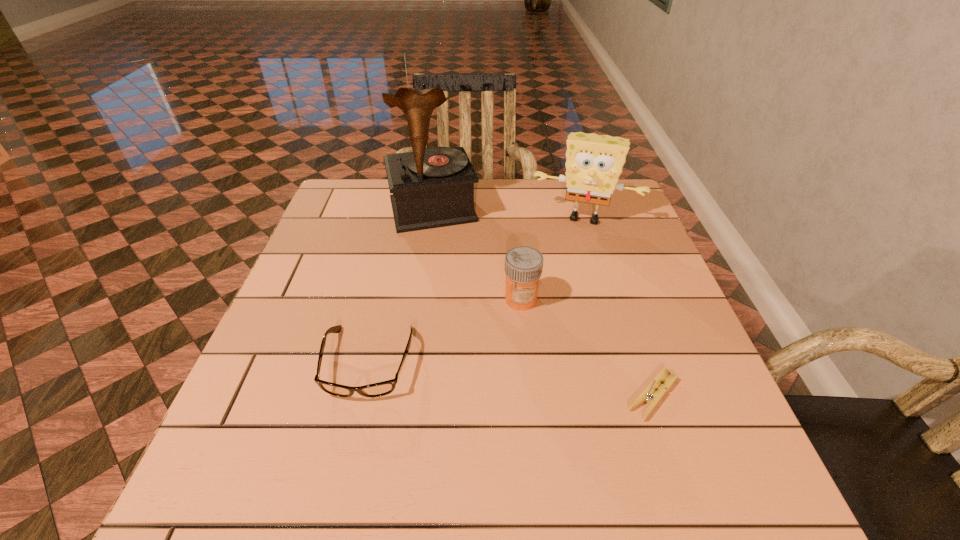
What are the coordinates of `vacant space at the far left corner of the desktop` in the screenshot? It's located at (334, 197).

Where is `free point at the near left corner`? This screenshot has height=540, width=960. free point at the near left corner is located at coordinates (300, 416).

At what (x,y) coordinates should I click in order to perform the action: click on free space at the near right corner. Please return your answer as a coordinate pair (x, y). This screenshot has width=960, height=540. Looking at the image, I should click on (711, 433).

This screenshot has width=960, height=540. I want to click on free point between the tallest object and the sponge, so click(x=509, y=213).

Image resolution: width=960 pixels, height=540 pixels. Identify the location of vacant area that lies between the phonograph_record and the clothespin. (542, 302).

Locate an element on the screen. free space between the sponge and the clothespin is located at coordinates (618, 306).

Where is `vacant region between the phonograph_record and the clothespin`? This screenshot has height=540, width=960. vacant region between the phonograph_record and the clothespin is located at coordinates pos(542,302).

What are the coordinates of `vacant space that is in between the phonograph_record and the second tallest object` in the screenshot? It's located at (509, 213).

What are the coordinates of `empty space that is in between the shortest object and the phonograph_record` in the screenshot? It's located at (542, 302).

Locate an element on the screen. This screenshot has height=540, width=960. empty location between the third tallest object and the second shortest object is located at coordinates (444, 331).